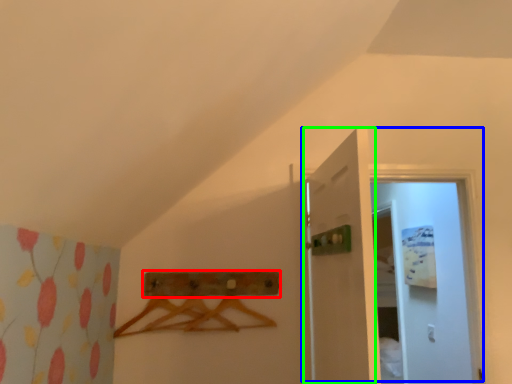
Question: Considering the real-world distances, which object is closest to drawer (highlighted by a red box)? door (highlighted by a blue box) or door (highlighted by a green box).

Choices:
 (A) door
 (B) door

Answer: (B)